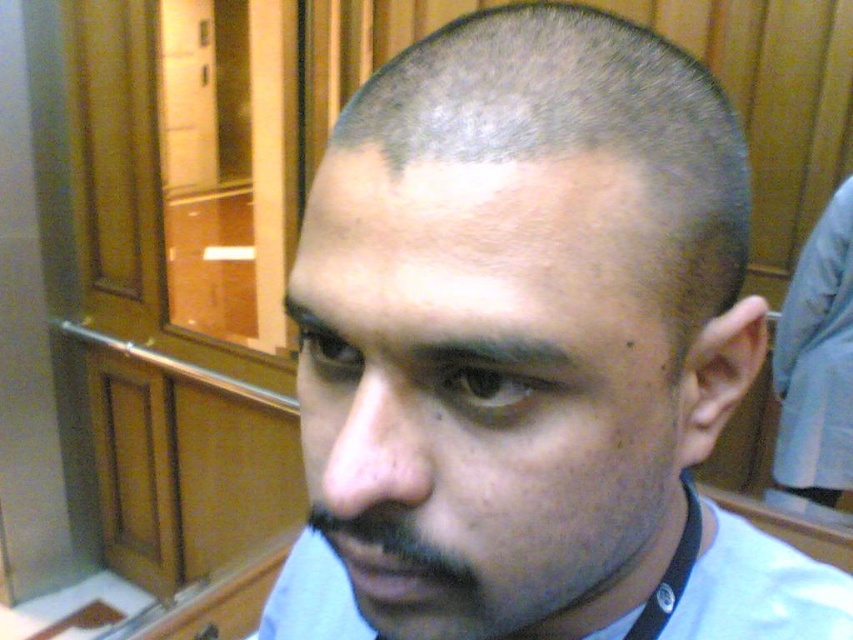
Is light blue shirt at center thinner than black fabric neckband at lower right?

No.

What do you see at coordinates (531, 349) in the screenshot? The height and width of the screenshot is (640, 853). I see `light blue shirt at center` at bounding box center [531, 349].

Where is `light blue shirt at center`? Image resolution: width=853 pixels, height=640 pixels. light blue shirt at center is located at coordinates (531, 349).

Who is positioned more to the right, light blue shirt at center or gray matte hair at upper center?

gray matte hair at upper center

What are the coordinates of `light blue shirt at center` in the screenshot? It's located at [531, 349].

Between gray matte hair at upper center and black fabric neckband at lower right, which one has more height?

gray matte hair at upper center is taller.

Identify the location of gray matte hair at upper center. This screenshot has width=853, height=640. (579, 131).